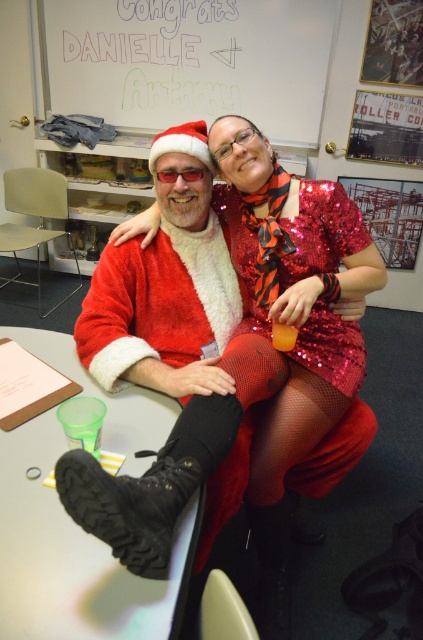
Question: Is fuzzy red santa suit at center further to camera compared to shiny sequined dress at center?

Choices:
 (A) yes
 (B) no

Answer: (B)

Question: Among these objects, which one is farthest from the camera?

Choices:
 (A) white plastic table at center
 (B) shiny sequined dress at center
 (C) fuzzy red santa suit at center

Answer: (B)

Question: Does fuzzy red santa suit at center appear on the right side of whiteboard at upper center?

Choices:
 (A) yes
 (B) no

Answer: (A)

Question: Does fuzzy red santa suit at center have a greater width compared to whiteboard at upper center?

Choices:
 (A) yes
 (B) no

Answer: (B)

Question: Considering the real-world distances, which object is farthest from the shiny sequined dress at center?

Choices:
 (A) whiteboard at upper center
 (B) fuzzy red santa suit at center

Answer: (A)

Question: Which of the following is the closest to the observer?

Choices:
 (A) white plastic table at center
 (B) shiny sequined dress at center

Answer: (A)